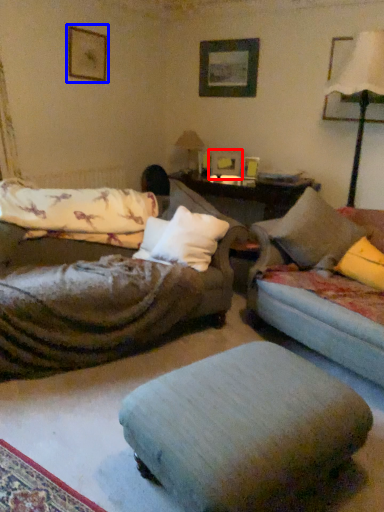
Question: Which object appears farthest to the camera in this image, picture frame (highlighted by a red box) or picture frame (highlighted by a blue box)?

Choices:
 (A) picture frame
 (B) picture frame

Answer: (A)